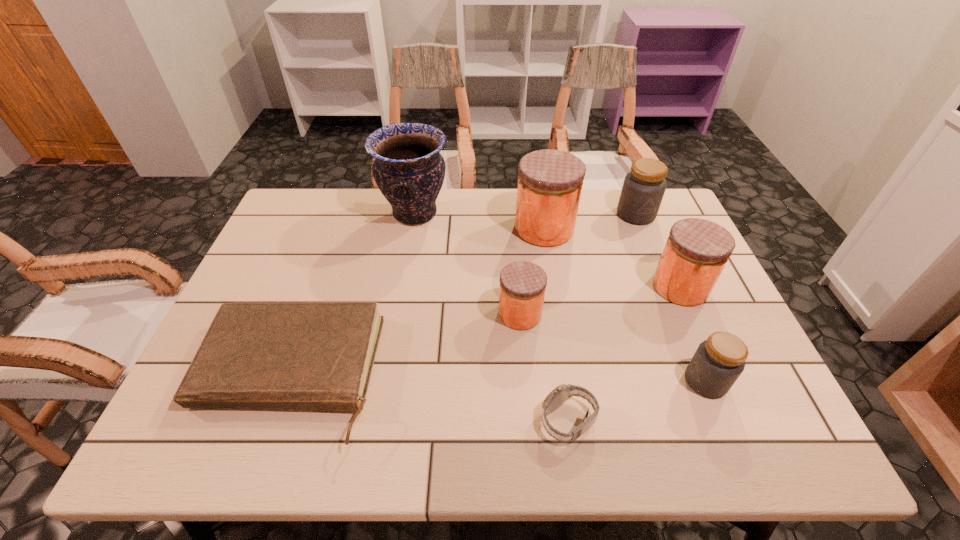
Locate an element on the screen. vacant space located on the face of the white watch is located at coordinates (361, 421).

Locate an element on the screen. The image size is (960, 540). free space located on the face of the white watch is located at coordinates (460, 421).

Locate an element on the screen. This screenshot has height=540, width=960. pottery located at the far edge is located at coordinates (409, 170).

What are the coordinates of `watch present at the near edge` in the screenshot? It's located at (563, 392).

The height and width of the screenshot is (540, 960). Find the location of `paperback book situated at the near edge`. paperback book situated at the near edge is located at coordinates (291, 356).

Where is `object present at the left edge`? The image size is (960, 540). object present at the left edge is located at coordinates (291, 356).

Locate an element on the screen. This screenshot has width=960, height=540. object that is at the near left corner is located at coordinates (291, 356).

Where is `object at the far right corner`? The image size is (960, 540). object at the far right corner is located at coordinates (643, 189).

What are the coordinates of `free space at the far edge of the desktop` in the screenshot? It's located at (477, 210).

Where is `vacant space at the near edge of the desktop`? The image size is (960, 540). vacant space at the near edge of the desktop is located at coordinates (458, 429).